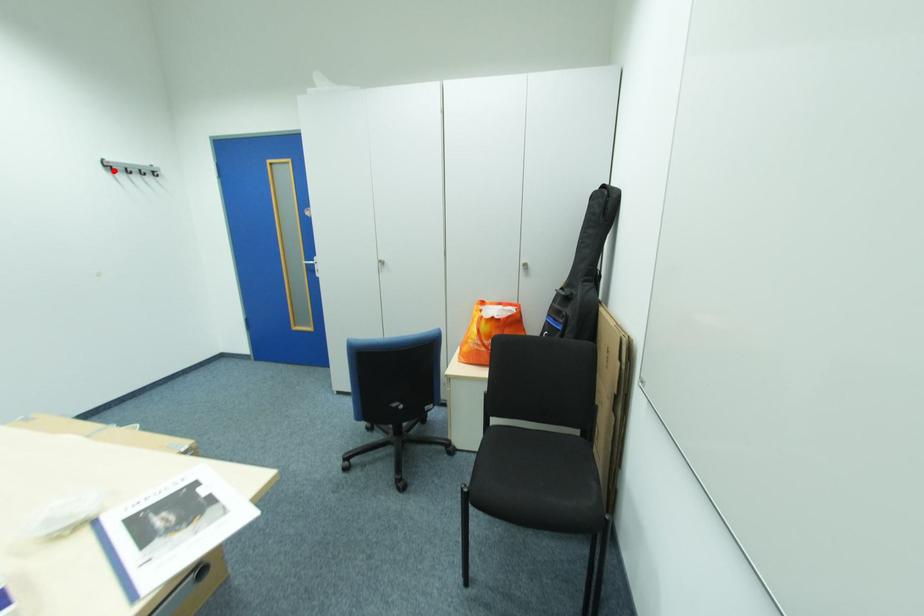
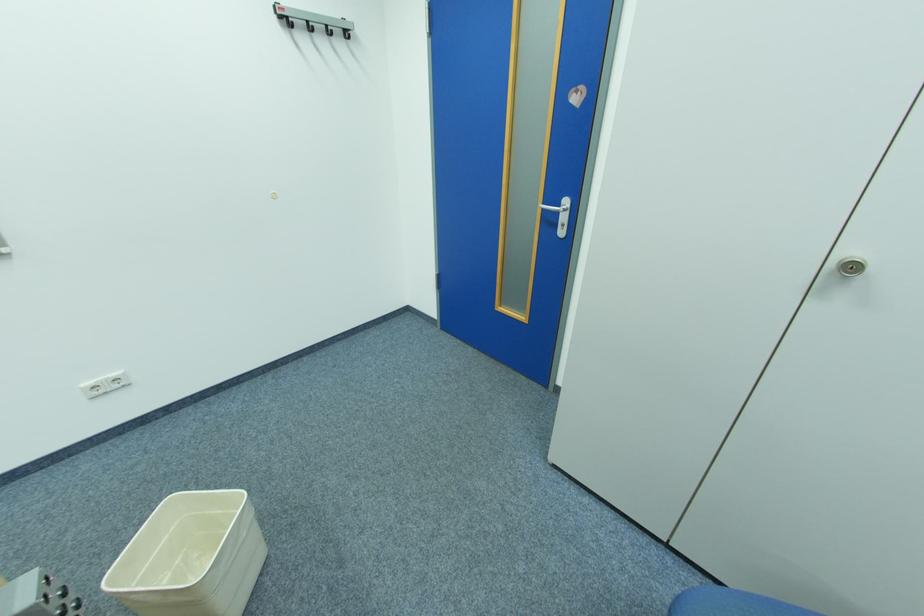
The point at the highlighted location is marked in the first image. Where is the corresponding point in the second image?

(290, 25)